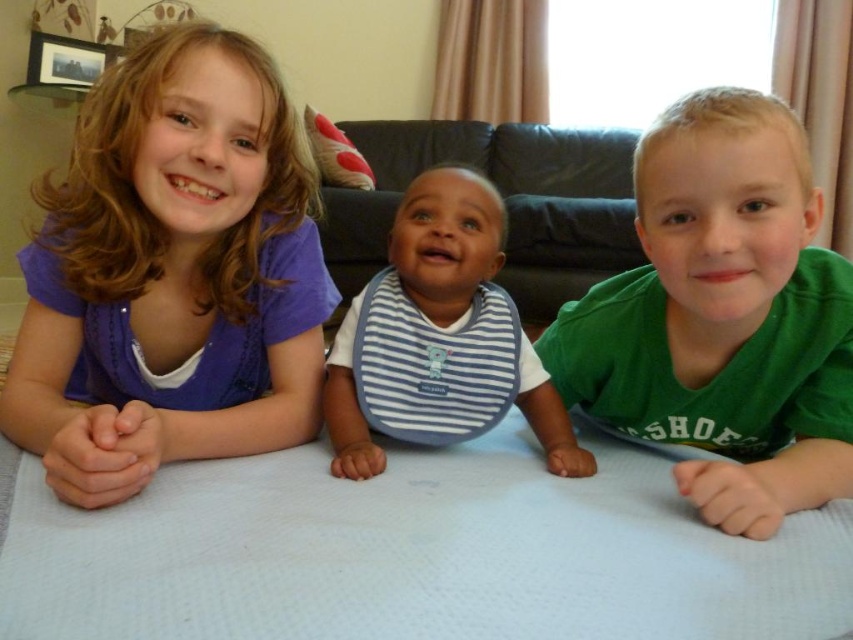
Question: Estimate the real-world distances between objects in this image. Which object is farther from the black leather couch at center?

Choices:
 (A) green cotton shirt at right
 (B) blue striped bib at center

Answer: (A)

Question: Which of the following is the farthest from the observer?

Choices:
 (A) (514, 381)
 (B) (358, 232)

Answer: (B)

Question: Observing the image, what is the correct spatial positioning of purple fabric shirt at left in reference to green cotton shirt at right?

Choices:
 (A) above
 (B) below

Answer: (A)

Question: Which point appears closest to the camera in this image?

Choices:
 (A) pyautogui.click(x=477, y=344)
 (B) pyautogui.click(x=228, y=211)
 (C) pyautogui.click(x=839, y=401)

Answer: (C)

Question: Can you confirm if blue striped bib at center is positioned above black leather couch at center?

Choices:
 (A) no
 (B) yes

Answer: (A)

Question: Does green cotton shirt at right appear under blue striped bib at center?

Choices:
 (A) no
 (B) yes

Answer: (B)